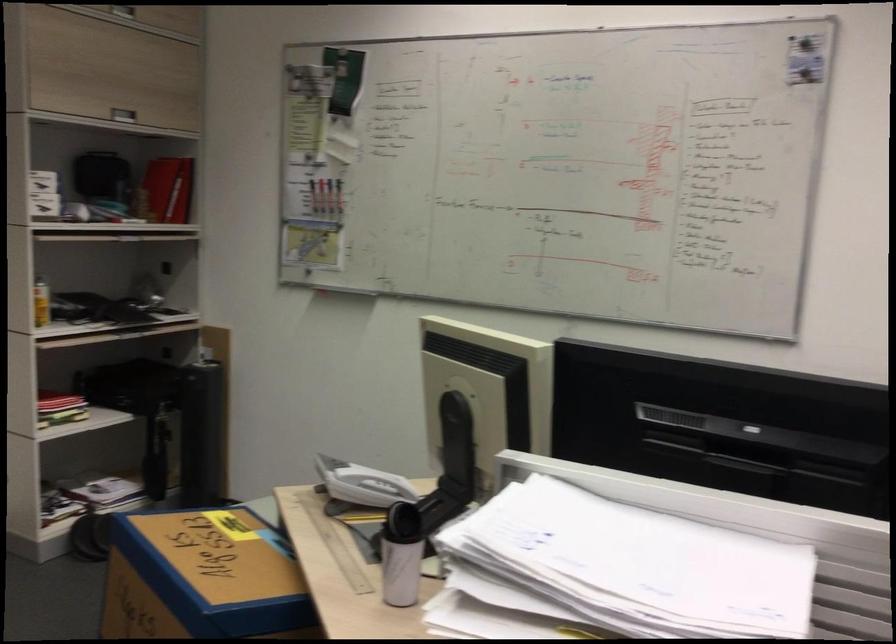
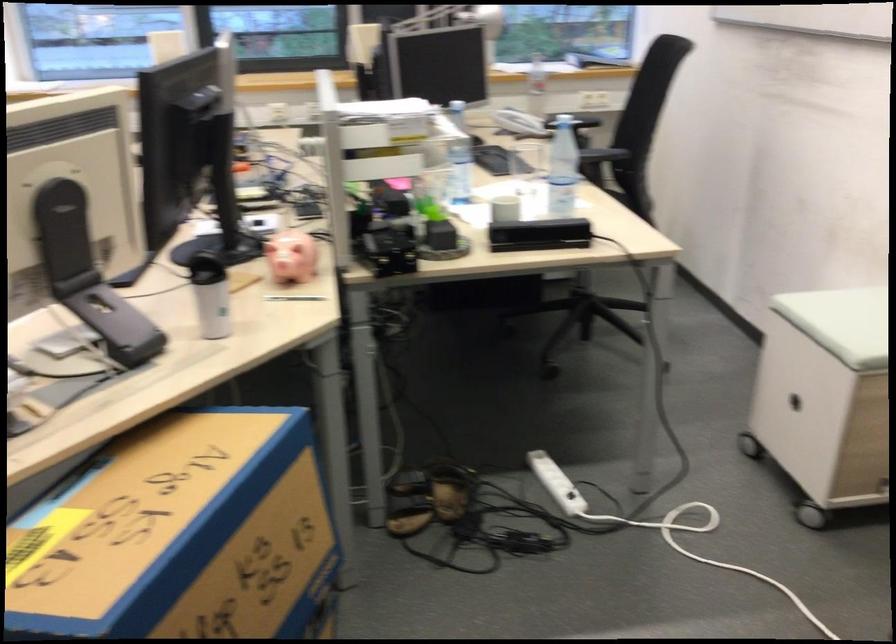
Locate, in the second image, the point that corresponds to the point at 392,550 in the first image.

(211, 295)